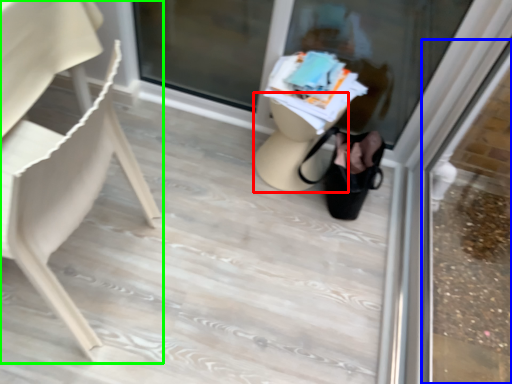
Question: Which object is positioned farthest from table (highlighted by a red box)? Select from shop window (highlighted by a blue box) and chair (highlighted by a green box).

Choices:
 (A) shop window
 (B) chair

Answer: (A)